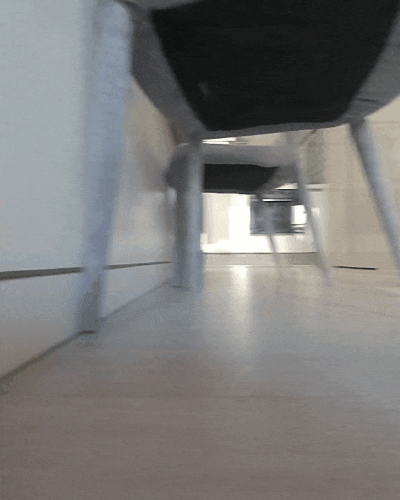
This screenshot has height=500, width=400. Identify the location of wood grain. (x=272, y=407), (x=200, y=410).